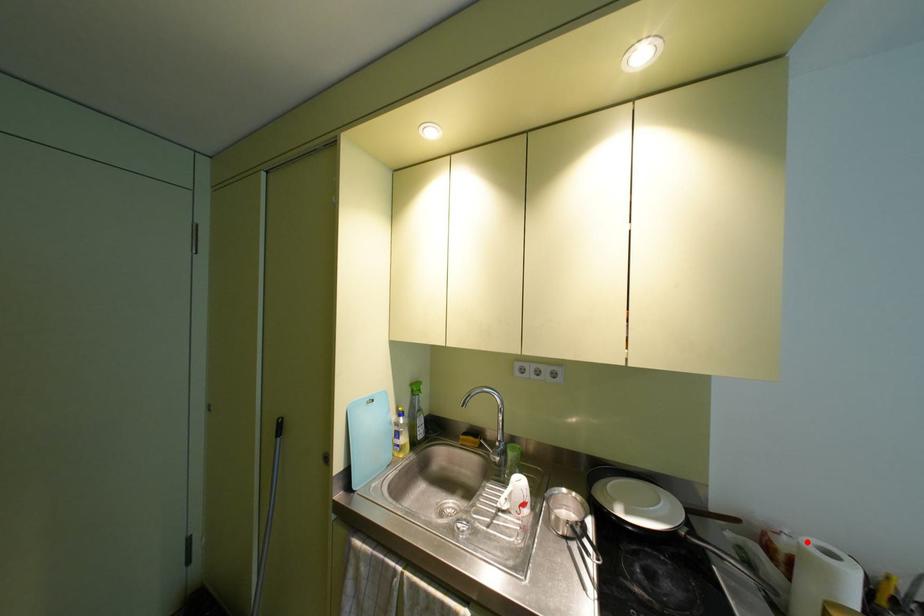
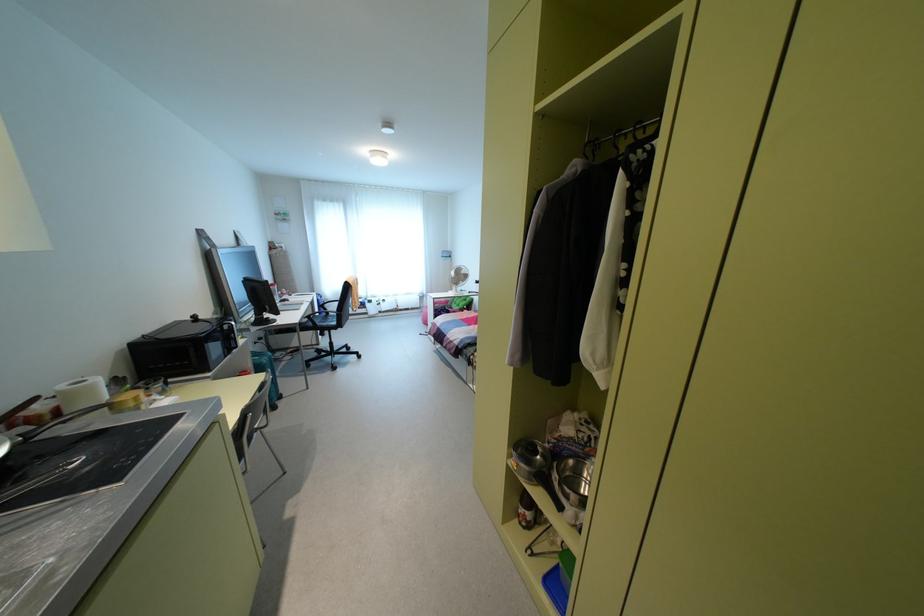
Question: I am providing you with two images of the same scene from different viewpoints. Given a red point in image1, look at the same physical point in image2. Is it:

Choices:
 (A) Closer to the viewpoint
 (B) Farther from the viewpoint

Answer: (B)